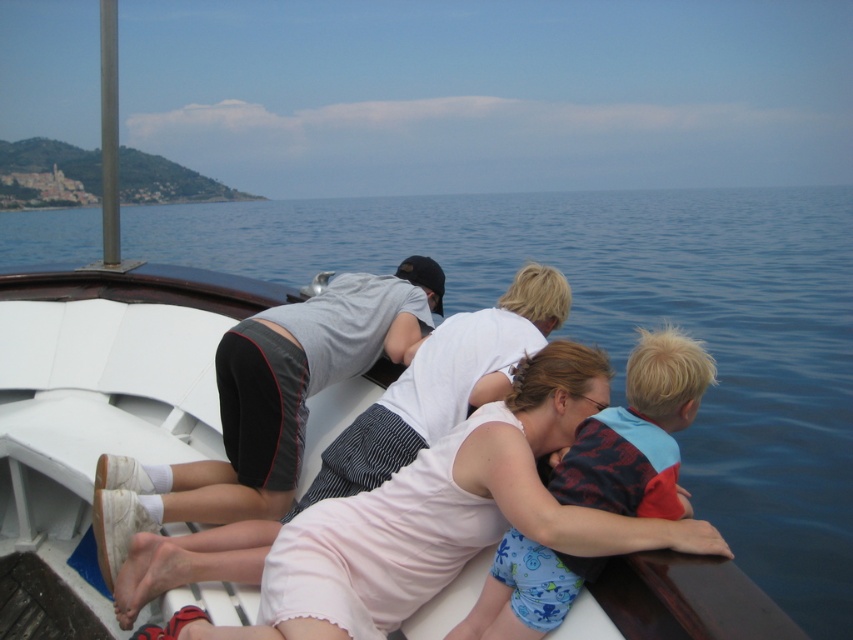
Is blue water at center above white cotton dress at center?

Correct, blue water at center is located above white cotton dress at center.

Who is more forward, (415, 244) or (552, 360)?

Point (552, 360) is in front.

The image size is (853, 640). Find the location of `blue water at center`. blue water at center is located at coordinates (633, 326).

Does blue water at center have a greater height compared to blue fabric life vest at center?

Yes, blue water at center is taller than blue fabric life vest at center.

This screenshot has height=640, width=853. What do you see at coordinates (633, 326) in the screenshot? I see `blue water at center` at bounding box center [633, 326].

The width and height of the screenshot is (853, 640). Find the location of `blue water at center`. blue water at center is located at coordinates (633, 326).

Between white cotton dress at center and blue fabric life vest at center, which one appears on the right side from the viewer's perspective?

blue fabric life vest at center

Which is behind, point (556, 401) or point (527, 637)?

Point (556, 401)

Which is in front, point (370, 496) or point (637, 419)?

Positioned in front is point (637, 419).

Locate an element on the screen. This screenshot has width=853, height=640. white cotton dress at center is located at coordinates (447, 515).